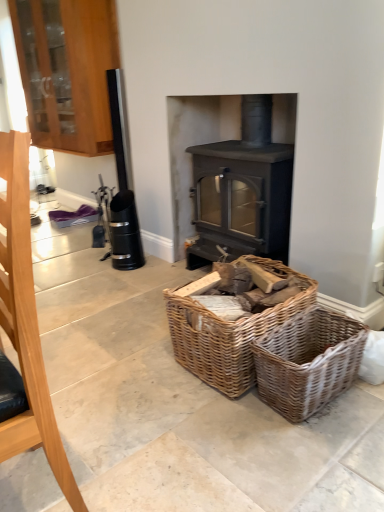
Question: Is brushed metal fireplace tool at left at the right side of wooden cabinet at upper left?

Choices:
 (A) yes
 (B) no

Answer: (A)

Question: Is brushed metal fireplace tool at left thinner than wooden cabinet at upper left?

Choices:
 (A) yes
 (B) no

Answer: (A)

Question: Is brushed metal fireplace tool at left positioned before wooden cabinet at upper left?

Choices:
 (A) yes
 (B) no

Answer: (A)

Question: Is brushed metal fireplace tool at left behind wooden cabinet at upper left?

Choices:
 (A) yes
 (B) no

Answer: (B)

Question: From the image's perspective, is brushed metal fireplace tool at left above wooden cabinet at upper left?

Choices:
 (A) no
 (B) yes

Answer: (A)

Question: Is brushed metal fireplace tool at left taller than wooden cabinet at upper left?

Choices:
 (A) yes
 (B) no

Answer: (B)

Question: From the image's perspective, is brushed metal fireplace tool at left below woven brown basket at lower center?

Choices:
 (A) yes
 (B) no

Answer: (B)

Question: From the image's perspective, is brushed metal fireplace tool at left on woven brown basket at lower center?

Choices:
 (A) no
 (B) yes

Answer: (B)

Question: Can you confirm if brushed metal fireplace tool at left is smaller than woven brown basket at lower center?

Choices:
 (A) yes
 (B) no

Answer: (B)

Question: Does brushed metal fireplace tool at left have a greater height compared to woven brown basket at lower center?

Choices:
 (A) no
 (B) yes

Answer: (B)

Question: Does brushed metal fireplace tool at left appear on the right side of woven brown basket at lower center?

Choices:
 (A) yes
 (B) no

Answer: (B)

Question: Is the position of brushed metal fireplace tool at left less distant than that of woven brown basket at lower center?

Choices:
 (A) yes
 (B) no

Answer: (A)

Question: Does wooden cabinet at upper left contain woven brown basket at lower center?

Choices:
 (A) no
 (B) yes

Answer: (A)